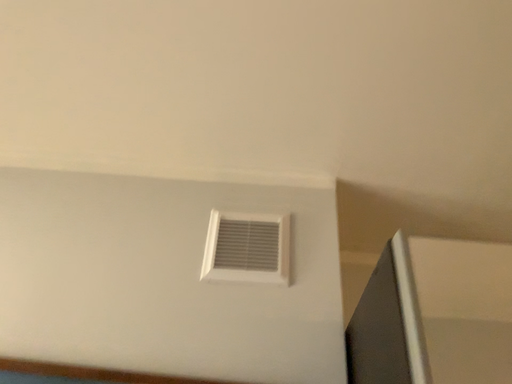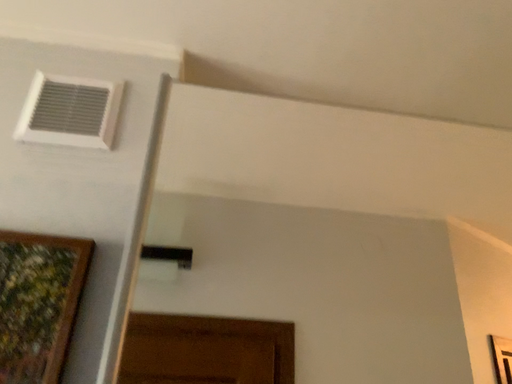
Question: How did the camera likely rotate when shooting the video?

Choices:
 (A) rotated left
 (B) rotated right

Answer: (B)